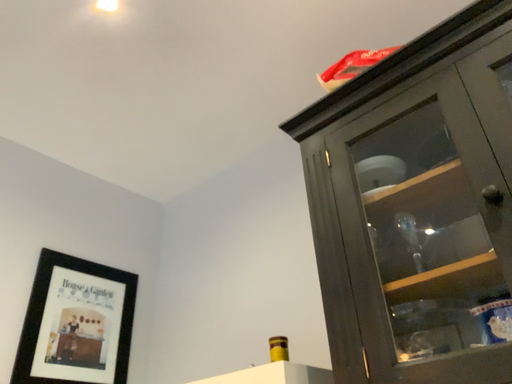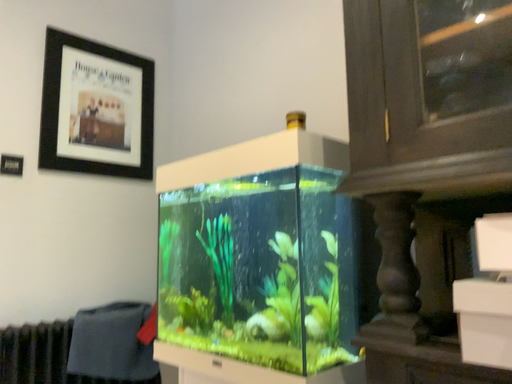
Question: Which way did the camera rotate in the video?

Choices:
 (A) rotated upward
 (B) rotated downward

Answer: (B)